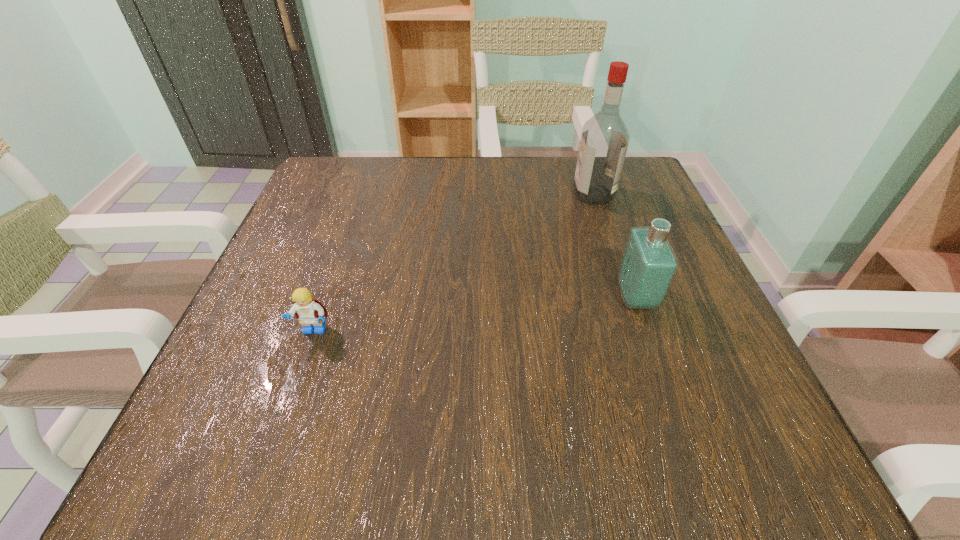
Locate an element on the screen. This screenshot has width=960, height=540. the tallest object is located at coordinates (604, 141).

Identify the location of the farthest object. This screenshot has width=960, height=540. (604, 141).

Image resolution: width=960 pixels, height=540 pixels. Identify the location of perfume. tap(648, 266).

Locate an element on the screen. The height and width of the screenshot is (540, 960). the shortest object is located at coordinates (310, 311).

Where is `the leftmost object`? The height and width of the screenshot is (540, 960). the leftmost object is located at coordinates (310, 311).

Locate an element on the screen. Image resolution: width=960 pixels, height=540 pixels. vacant space located on the front-facing side of the farthest object is located at coordinates (442, 194).

Image resolution: width=960 pixels, height=540 pixels. In order to click on vacant space situated on the front-facing side of the farthest object in this screenshot , I will do `click(499, 194)`.

Locate an element on the screen. Image resolution: width=960 pixels, height=540 pixels. vacant area situated 0.080m on the front-facing side of the farthest object is located at coordinates tap(539, 194).

Where is `free space located on the front label of the perfume`? The width and height of the screenshot is (960, 540). free space located on the front label of the perfume is located at coordinates (469, 298).

Identify the location of vacant space located 0.280m on the front label of the perfume. (458, 298).